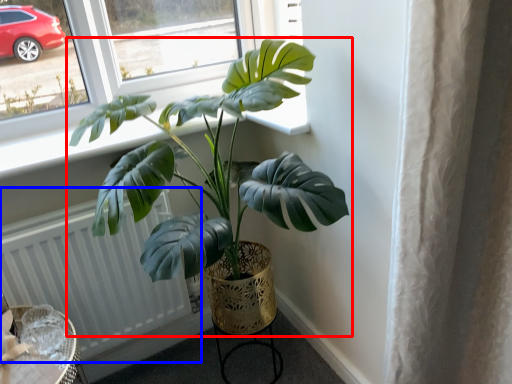
Question: Which of the following is the farthest to the observer, houseplant (highlighted by a red box) or radiator (highlighted by a blue box)?

Choices:
 (A) houseplant
 (B) radiator

Answer: (B)